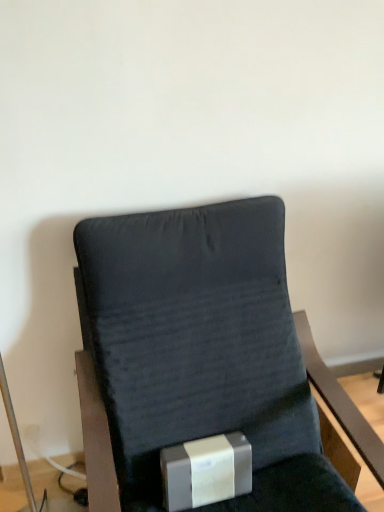
Question: Considering the positions of dark fabric chair at center and silver metallic box at lower center in the image, is dark fabric chair at center wider or thinner than silver metallic box at lower center?

Choices:
 (A) thin
 (B) wide

Answer: (B)

Question: From the image's perspective, is dark fabric chair at center above or below silver metallic box at lower center?

Choices:
 (A) below
 (B) above

Answer: (B)

Question: Visually, is dark fabric chair at center positioned to the left or to the right of silver metallic box at lower center?

Choices:
 (A) right
 (B) left

Answer: (A)

Question: In the image, is silver metallic box at lower center on the left side or the right side of dark fabric chair at center?

Choices:
 (A) left
 (B) right

Answer: (A)

Question: Relative to dark fabric chair at center, is silver metallic box at lower center in front or behind?

Choices:
 (A) front
 (B) behind

Answer: (B)

Question: Looking at the image, does silver metallic box at lower center seem bigger or smaller compared to dark fabric chair at center?

Choices:
 (A) small
 (B) big

Answer: (A)

Question: In terms of height, does silver metallic box at lower center look taller or shorter compared to dark fabric chair at center?

Choices:
 (A) tall
 (B) short

Answer: (B)